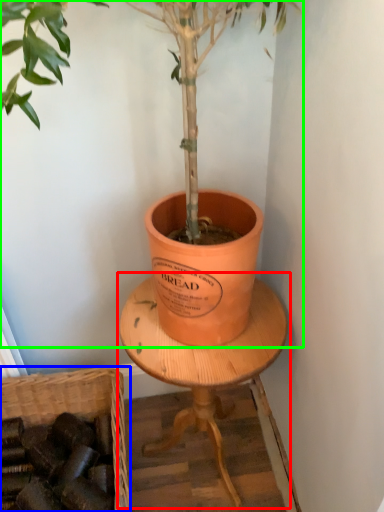
Question: Considering the real-world distances, which object is closest to round table (highlighted by a red box)? basket (highlighted by a blue box) or houseplant (highlighted by a green box).

Choices:
 (A) basket
 (B) houseplant

Answer: (B)